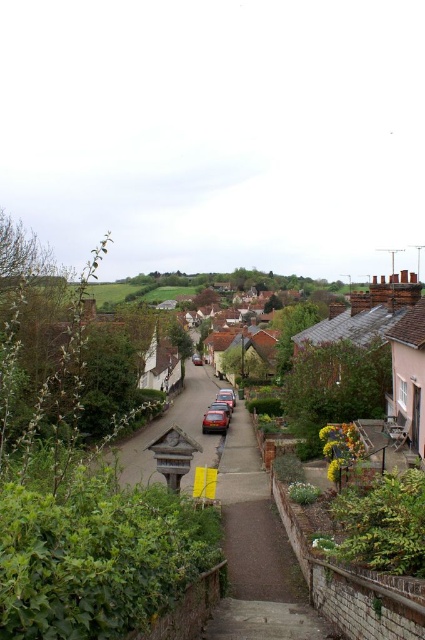
You are a delivery person trying to navigate through the village street. You see a shiny metallic car at center and a metallic red car at center. Which car is blocking the path of the other?

The shiny metallic car at center is positioned under metallic red car at center, so the metallic red car at center is blocking the path of the shiny metallic car at center.

Consider the image. You are standing at the point marked as point (231,416) in the village street scene. You want to take a photo of the entire village from your current position. Considering the distance between you and the camera, will the camera be able to capture the entire village in one shot?

The point (231,416) and camera are 193.07 feet apart from each other. Since the camera is 193.07 feet away from your current position, it should be able to capture the entire village in one shot as the distance is sufficient to encompass the view.

You are a delivery driver needing to park your truck, which is 2 meters wide, in the village. You see a shiny metallic car at center and a metallic red car at center. Can you fit your truck between them if there is a 3 meter gap between the two cars?

The shiny metallic car at center might be wider than metallic red car at center, so the gap between them is 3 meters. Since your truck is 2 meters wide, it should fit comfortably between them.